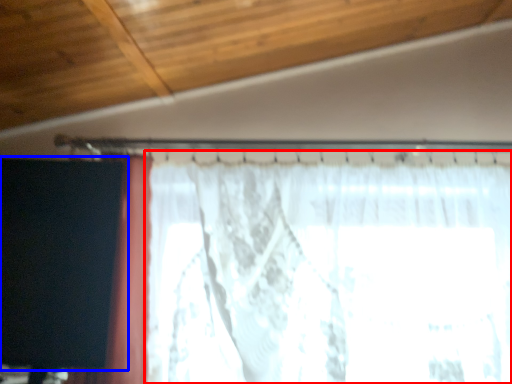
Question: Which object is further to the camera taking this photo, curtain (highlighted by a red box) or curtain (highlighted by a blue box)?

Choices:
 (A) curtain
 (B) curtain

Answer: (A)